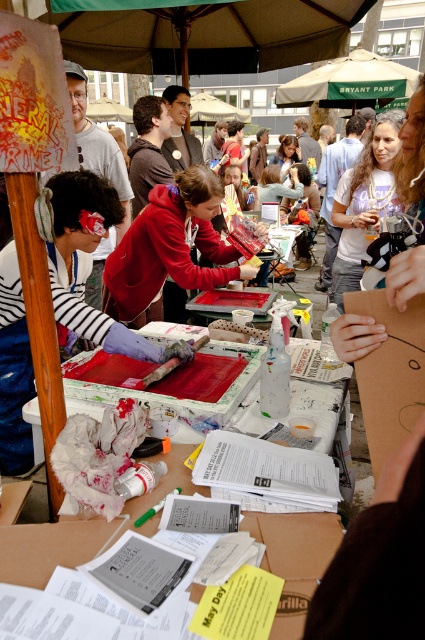
Is red glossy table at center shorter than matte white t-shirt at center?

Indeed, red glossy table at center has a lesser height compared to matte white t-shirt at center.

What do you see at coordinates (294, 560) in the screenshot? The image size is (425, 640). I see `red glossy table at center` at bounding box center [294, 560].

The image size is (425, 640). What do you see at coordinates (294, 560) in the screenshot? I see `red glossy table at center` at bounding box center [294, 560].

Locate an element on the screen. red glossy table at center is located at coordinates 294,560.

Which is below, red glossy table at center or brown cardboard at center?

red glossy table at center is lower down.

Is point (36, 554) positioned before point (413, 380)?

No, (36, 554) is behind (413, 380).

The height and width of the screenshot is (640, 425). I want to click on red glossy table at center, so [294, 560].

Between red glossy table at center and smooth skin face at center, which one has more height?

Standing taller between the two is smooth skin face at center.

Is red glossy table at center behind smooth skin face at center?

That is False.

This screenshot has width=425, height=640. What are the coordinates of `red glossy table at center` in the screenshot? It's located at (294, 560).